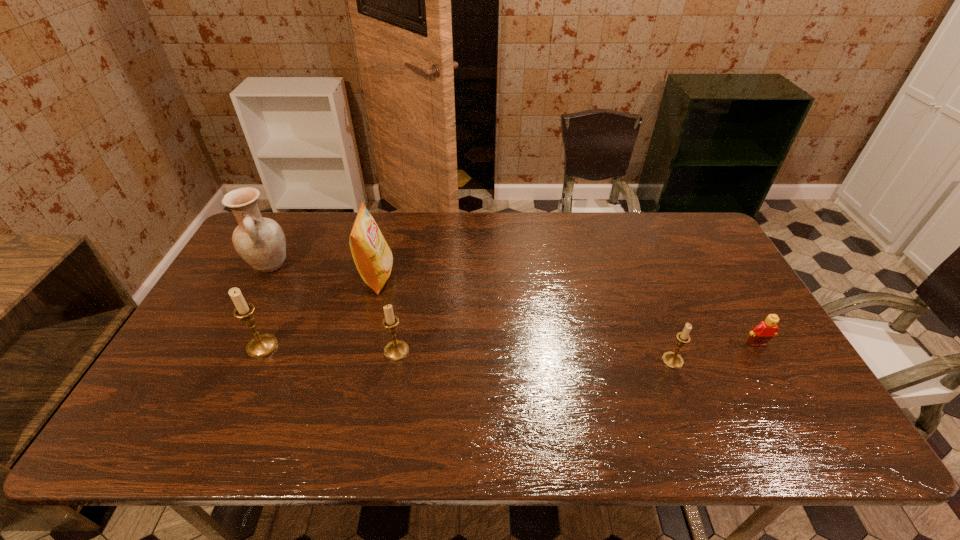
Find the location of a particular element. Image resolution: width=960 pixels, height=540 pixels. blank space at the near edge is located at coordinates (606, 400).

In the image, there is a desktop. At what (x,y) coordinates should I click in order to perform the action: click on free space at the right edge. Please return your answer as a coordinate pair (x, y). Looking at the image, I should click on (692, 279).

In the image, there is a desktop. Identify the location of vacant space at the far right corner. The width and height of the screenshot is (960, 540). (685, 245).

Identify the location of blank region between the Lego and the pottery. The image size is (960, 540). (514, 305).

This screenshot has width=960, height=540. In order to click on vacant region between the rightmost object and the rightmost candle holder in this screenshot , I will do `click(714, 353)`.

Find the location of a particular element. unoccupied position between the pottery and the shortest object is located at coordinates (514, 305).

At what (x,y) coordinates should I click in order to perform the action: click on unoccupied position between the tallest candle holder and the fourth object from left to right. Please return your answer as a coordinate pair (x, y). The image size is (960, 540). Looking at the image, I should click on (329, 349).

Where is `vacant space that's between the second tallest candle holder and the tallest candle holder`? The height and width of the screenshot is (540, 960). vacant space that's between the second tallest candle holder and the tallest candle holder is located at coordinates (329, 349).

In order to click on empty space between the second object from right to left and the rightmost object in this screenshot , I will do [714, 353].

Where is `free space between the leftmost candle holder and the shortest candle holder`? Image resolution: width=960 pixels, height=540 pixels. free space between the leftmost candle holder and the shortest candle holder is located at coordinates (468, 354).